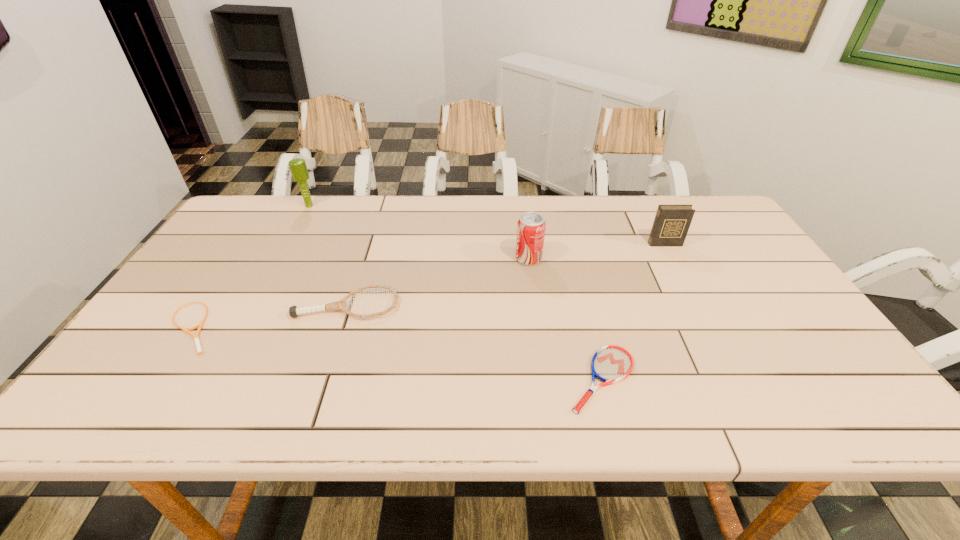
Identify the location of the fifth object from right to left. (298, 167).

Find the location of a particular element. Image resolution: width=960 pixels, height=540 pixels. microphone is located at coordinates (298, 167).

The width and height of the screenshot is (960, 540). Find the location of `the third object from right to left`. the third object from right to left is located at coordinates (531, 226).

Locate an element on the screen. the third farthest object is located at coordinates (531, 226).

You are a GUI agent. You are given a task and a screenshot of the screen. Output one action in this format:
    pyautogui.click(x=<x>, y=<y>)
    Task: Click on the diary
    
    Given the screenshot: What is the action you would take?
    pyautogui.click(x=671, y=224)

I want to click on the rightmost object, so click(x=671, y=224).

Locate an element on the screen. Image resolution: width=960 pixels, height=540 pixels. the second tennis racket from left to right is located at coordinates (294, 311).

Where is `the third object from left to right`? the third object from left to right is located at coordinates (294, 311).

At what (x,y) coordinates should I click in order to perform the action: click on the second tallest tennis racket. Please return your answer as a coordinate pair (x, y). The image size is (960, 540). Looking at the image, I should click on (610, 364).

Find the location of `the fifth tallest object`. the fifth tallest object is located at coordinates (610, 364).